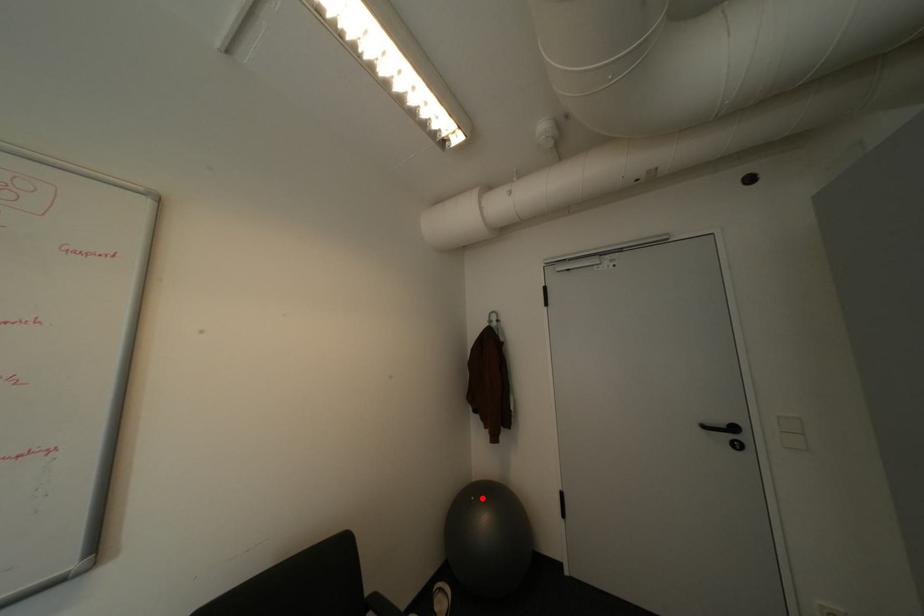
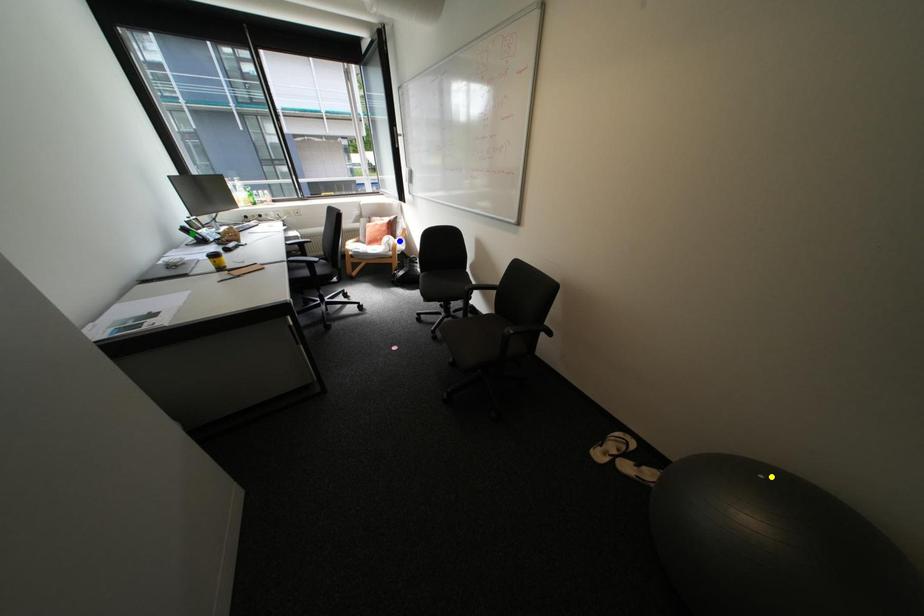
Question: I am providing you with two images of the same scene from different viewpoints. A red point is marked on the first image. You are given multiple points on the second image. Which point in image 2 is actually the same real-world point as the red point in image 1?

Choices:
 (A) green point
 (B) blue point
 (C) yellow point

Answer: (C)